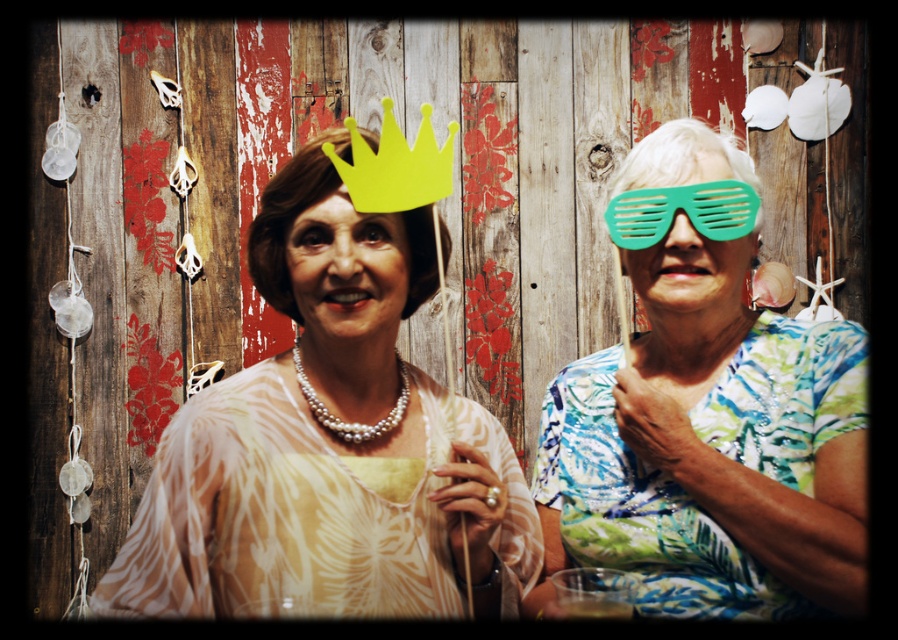
You are a photographer trying to decide where to place a new prop, a small potted plant, in the scene. The yellow paper crown at center and the green plastic goggles at right are already present. Based on their sizes, where should you place the potted plant to avoid blocking the smaller object?

The yellow paper crown at center is much taller than the green plastic goggles at right, so you should place the potted plant near the green plastic goggles at right to avoid blocking the smaller object.

You are a photographer trying to adjust the lighting for a photo shoot. You notice the white sheer dress at center and the yellow paper crown at center. Which object is positioned to the right of the other?

The white sheer dress at center is to the right of the yellow paper crown at center.